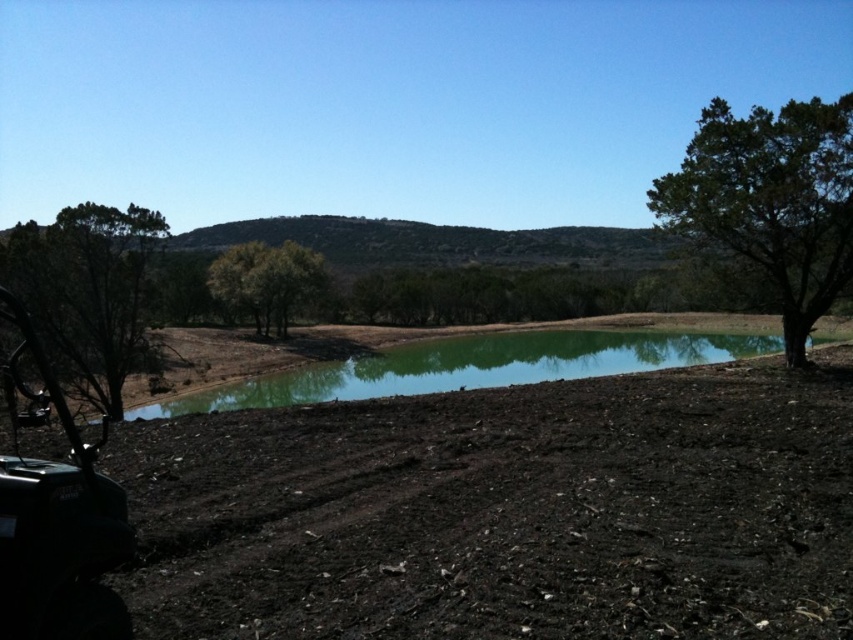
You are a hiker who wants to cross the green reflective water at center to reach the other side. However, there is a green leafy tree at left nearby. Which direction should you go to avoid the tree?

The green reflective water at center is positioned under the green leafy tree at left, so to avoid the tree, you should go in the opposite direction of the green leafy tree at left, possibly to the right side of the tree.

You are planning to take a photo of the black matte jeep at left and the green leafy tree at right. Which object should you focus on first if you want to capture both in a single frame without moving the camera?

The green leafy tree at right should be focused on first because it is much taller than the black matte jeep at left, so adjusting focus to the tree ensures both are in frame.